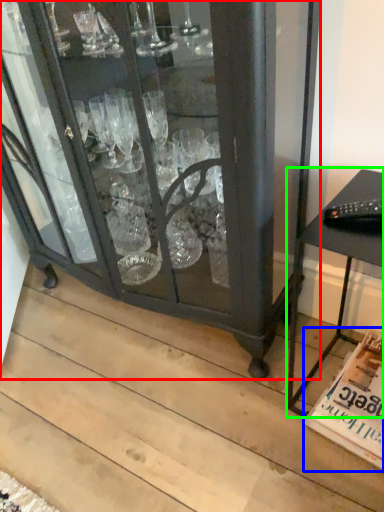
Question: Based on their relative distances, which object is farther from furniture (highlighted by a red box)? Choose from magazine (highlighted by a blue box) and table (highlighted by a green box).

Choices:
 (A) magazine
 (B) table

Answer: (A)